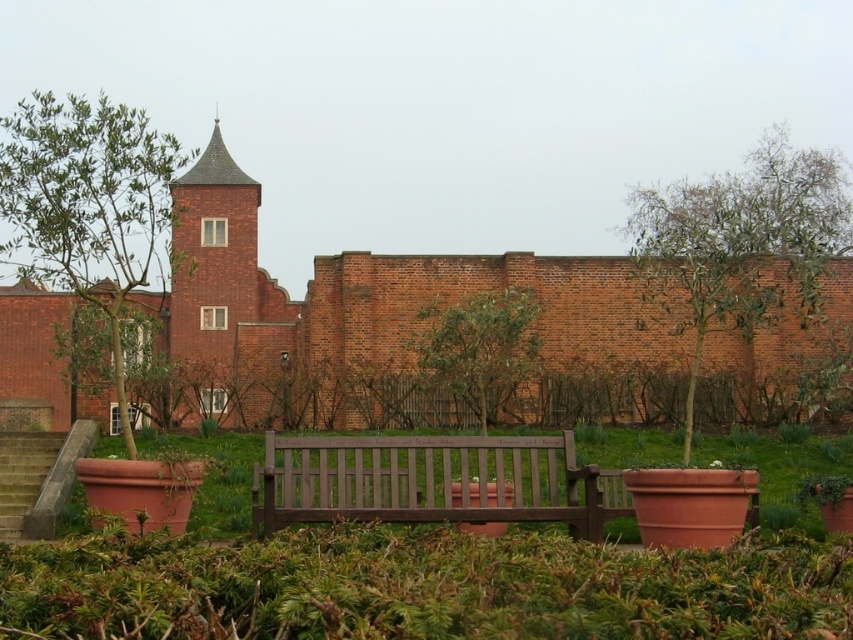
In the scene shown: You are a painter standing at the bottom of the concrete stairs at lower left, wanting to paint the dark brown wooden bench at center. Which object is higher in elevation?

The dark brown wooden bench at center is much taller than the concrete stairs at lower left, so it is higher in elevation.

You are standing at the center of the garden and want to sit on the dark brown wooden bench at center. According to the coordinates provided, in which direction should you move to reach the bench?

The dark brown wooden bench at center is located at coordinates point (x=431, y=481), so you should move towards the right direction to reach it.